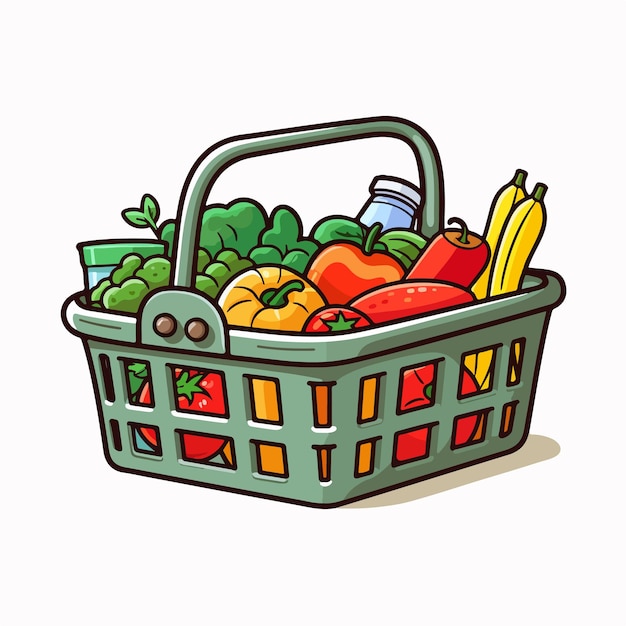
Locate an element on the screen. The width and height of the screenshot is (626, 626). basket is located at coordinates (290, 365).